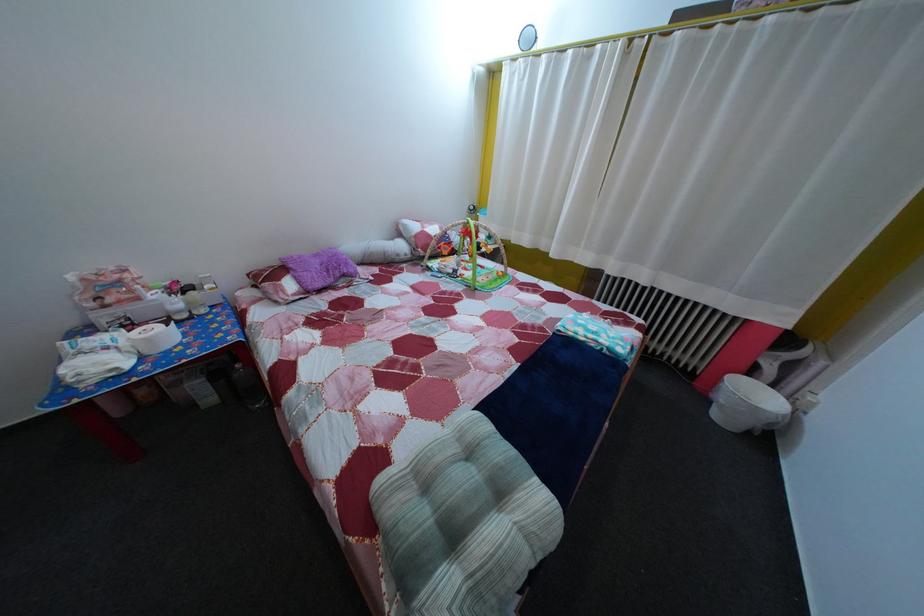
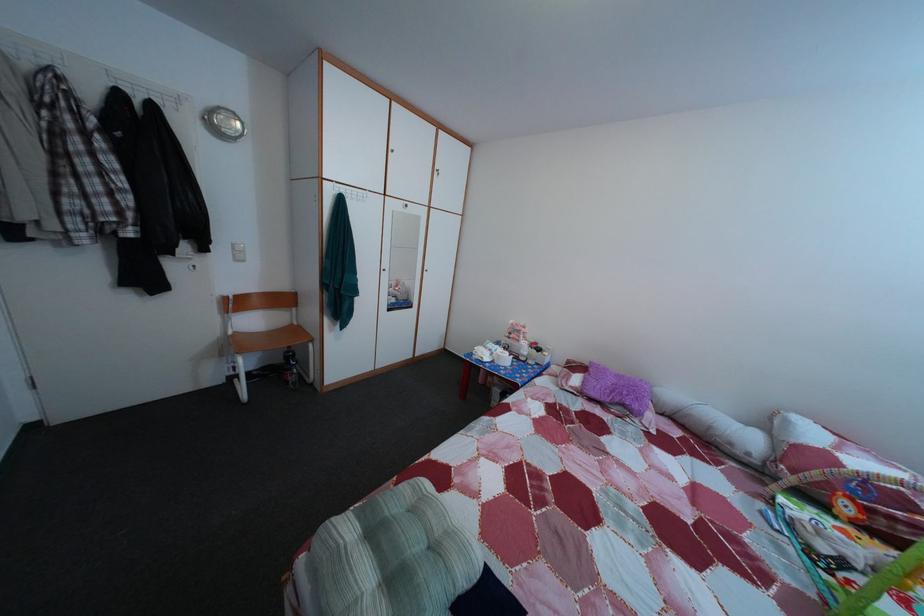
Locate, in the second image, the point that corresponds to (x=448, y=467) in the first image.

(440, 521)